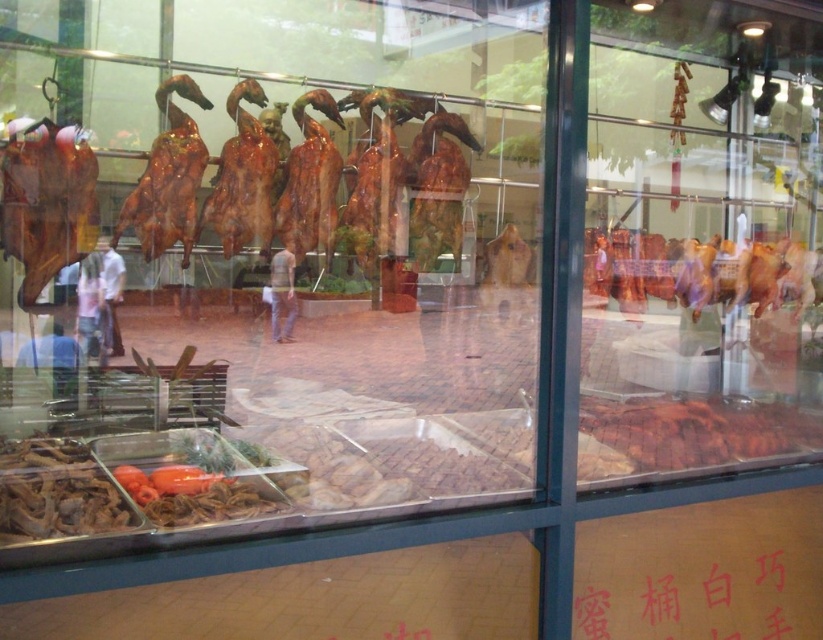
Does brown matte dried mushrooms at lower left have a smaller size compared to light brown leather jacket at center?

Indeed, brown matte dried mushrooms at lower left has a smaller size compared to light brown leather jacket at center.

Who is shorter, brown matte dried mushrooms at lower left or light brown leather jacket at center?

brown matte dried mushrooms at lower left is shorter.

Which is behind, point (44, 508) or point (275, 324)?

Positioned behind is point (275, 324).

Where is `brown matte dried mushrooms at lower left`? The height and width of the screenshot is (640, 823). brown matte dried mushrooms at lower left is located at coordinates (56, 492).

Does red paper sign at center appear on the right side of shiny brown duck at left?

Correct, you'll find red paper sign at center to the right of shiny brown duck at left.

Can you confirm if red paper sign at center is positioned above shiny brown duck at left?

No, red paper sign at center is not above shiny brown duck at left.

Between point (682, 554) and point (77, 150), which one is positioned in front?

Point (77, 150) is more forward.

This screenshot has height=640, width=823. I want to click on red paper sign at center, so click(687, 593).

Is point (775, 428) less distant than point (636, 304)?

That is True.

In order to click on brown matte roasted duck at center in this screenshot , I will do `click(696, 429)`.